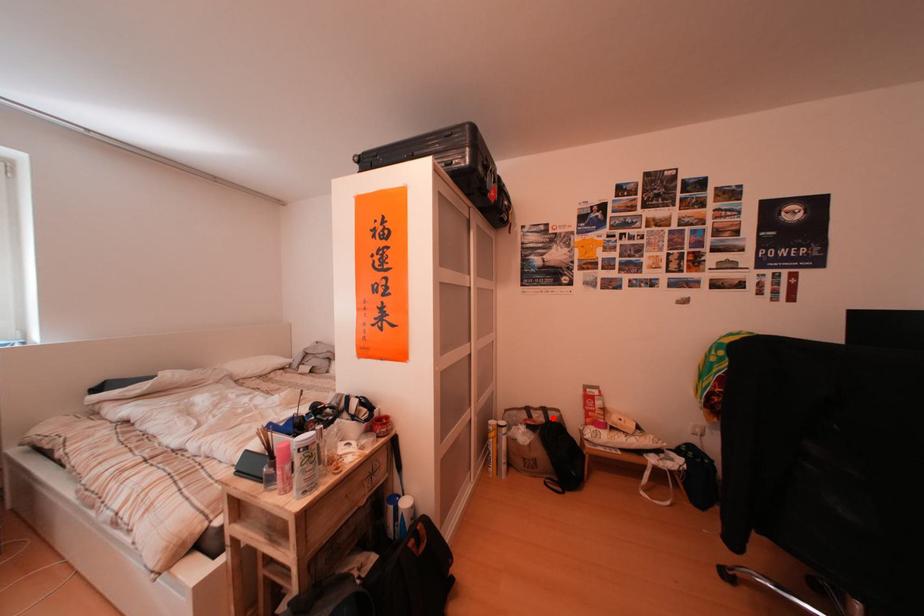
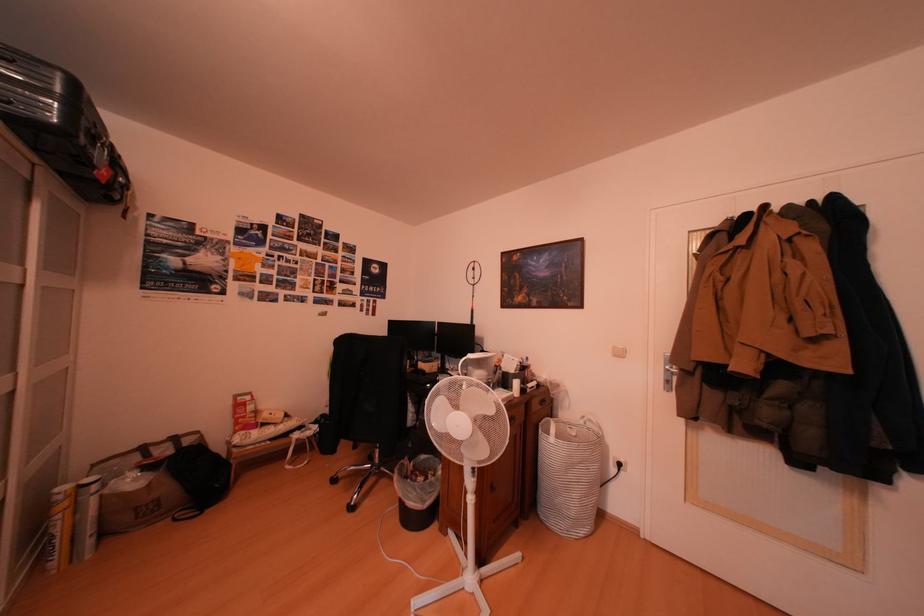
Where in the second image is the point corresponding to the highlighted location from the first image?

(180, 450)